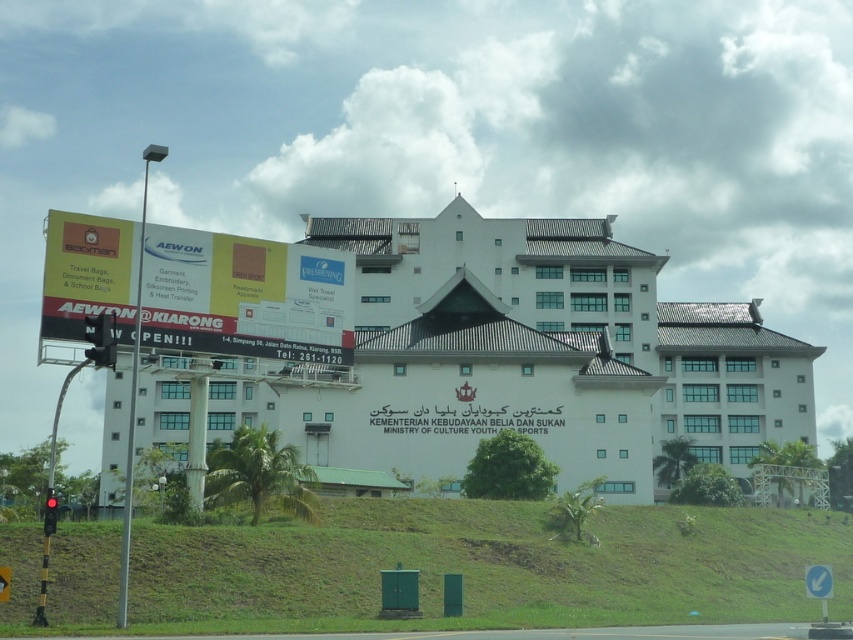
Is blue plastic arrow at lower right positioned behind red glass traffic light at left?

No, it is in front of red glass traffic light at left.

Is blue plastic arrow at lower right below red glass traffic light at left?

Yes, blue plastic arrow at lower right is below red glass traffic light at left.

Is point (824, 605) positioned after point (45, 512)?

No, (824, 605) is in front of (45, 512).

The image size is (853, 640). I want to click on blue plastic arrow at lower right, so click(x=819, y=586).

From the picture: Can you confirm if green grassy hillside at lower center is positioned to the left of red matte traffic light at left?

No, green grassy hillside at lower center is not to the left of red matte traffic light at left.

Can you confirm if green grassy hillside at lower center is smaller than red matte traffic light at left?

No.

Where is `green grassy hillside at lower center`? green grassy hillside at lower center is located at coordinates (486, 566).

Who is more distant from viewer, (230, 307) or (45, 500)?

The point (230, 307) is more distant.

Does yellow cardboard billboard at upper left come behind red glass traffic light at left?

Yes.

The width and height of the screenshot is (853, 640). Describe the element at coordinates (245, 296) in the screenshot. I see `yellow cardboard billboard at upper left` at that location.

Where is `yellow cardboard billboard at upper left`? This screenshot has height=640, width=853. yellow cardboard billboard at upper left is located at coordinates (245, 296).